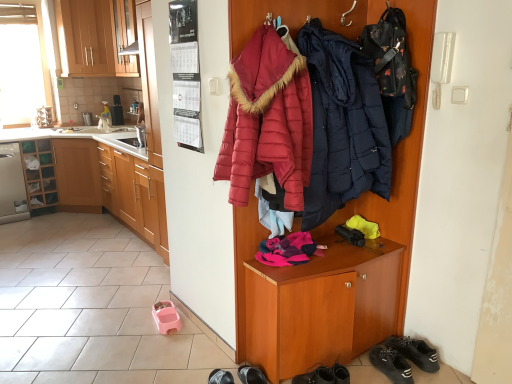
This screenshot has width=512, height=384. What are the coordinates of `vacant area to the left of black suede sneakers at lower right, which is the first footwear in right-to-left order` in the screenshot? It's located at (362, 371).